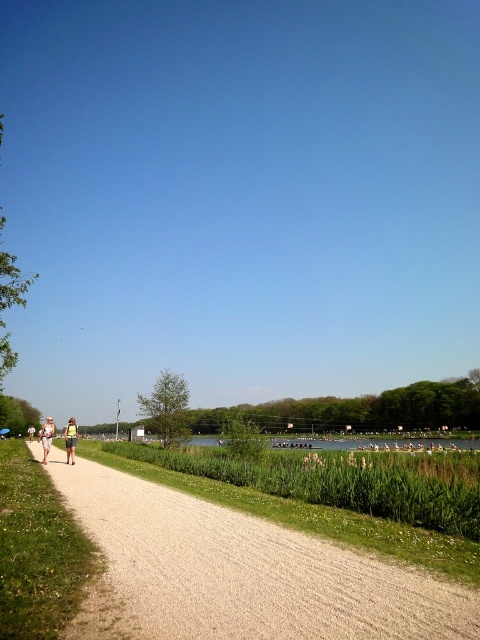
You are a photographer trying to capture a clear shot of the light beige fabric couple at center and the light beige shorts at center. Since both are light beige, you want to ensure they are distinguishable in the photo. Which object should you focus on to ensure it stands out more due to its height?

The light beige shorts at center should be focused on because it has a greater height compared to the light beige fabric couple at center, making it more prominent in the photo.

Consider the image. You are standing on the gravel path in the scene. You notice a point marked at coordinates (47, 436). What object or feature does this point correspond to?

The point at coordinates (47, 436) corresponds to the light beige fabric couple at center.